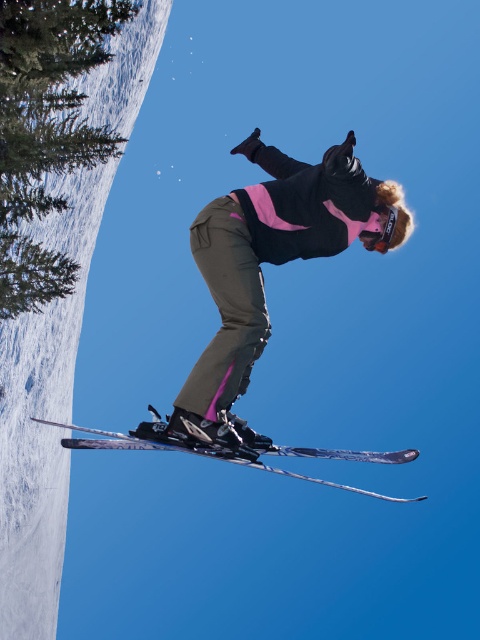
Question: Considering the relative positions of matte black ski suit at center and shiny metallic skis at center in the image provided, where is matte black ski suit at center located with respect to shiny metallic skis at center?

Choices:
 (A) left
 (B) right

Answer: (B)

Question: Is matte black ski suit at center further to camera compared to shiny metallic skis at center?

Choices:
 (A) no
 (B) yes

Answer: (A)

Question: Is matte black ski suit at center wider than shiny metallic skis at center?

Choices:
 (A) yes
 (B) no

Answer: (A)

Question: Which point is farther to the camera?

Choices:
 (A) (264, 346)
 (B) (157, 449)

Answer: (B)

Question: Which object appears farthest from the camera in this image?

Choices:
 (A) shiny metallic skis at center
 (B) matte black ski suit at center

Answer: (A)